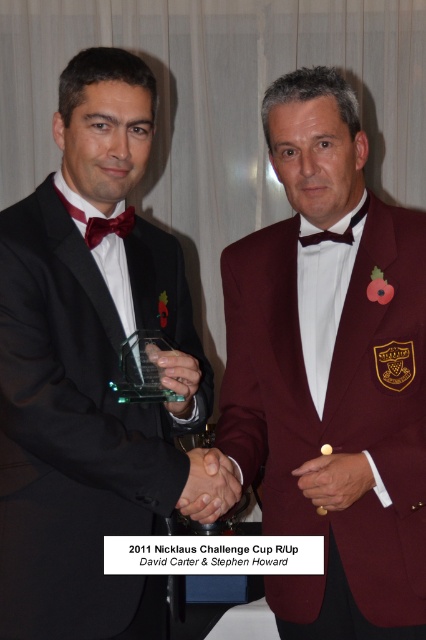
Can you confirm if maroon woolen blazer at center is thinner than matte red bow tie at left?

In fact, maroon woolen blazer at center might be wider than matte red bow tie at left.

Who is higher up, maroon woolen blazer at center or matte red bow tie at left?

Positioned higher is matte red bow tie at left.

Locate an element on the screen. maroon woolen blazer at center is located at coordinates (330, 372).

Can you confirm if matte black tuxedo at left is positioned above matte red bow tie at left?

No, matte black tuxedo at left is not above matte red bow tie at left.

Which of these two, matte black tuxedo at left or matte red bow tie at left, stands taller?

With more height is matte black tuxedo at left.

Does point (11, 627) come in front of point (94, 234)?

Yes, it is in front of point (94, 234).

You are a GUI agent. You are given a task and a screenshot of the screen. Output one action in this format:
    pyautogui.click(x=<x>, y=<y>)
    Task: Click on the matte black tuxedo at left
    This screenshot has width=426, height=640.
    Given the screenshot: What is the action you would take?
    pyautogui.click(x=92, y=372)

Is maroon woolen blazer at center closer to camera compared to matte black tuxedo at left?

No, it is behind matte black tuxedo at left.

Is point (233, 397) positioned in front of point (172, 337)?

No, it is not.

Between point (342, 612) and point (94, 515), which one is positioned in front?

Point (94, 515) is more forward.

I want to click on maroon woolen blazer at center, so click(x=330, y=372).